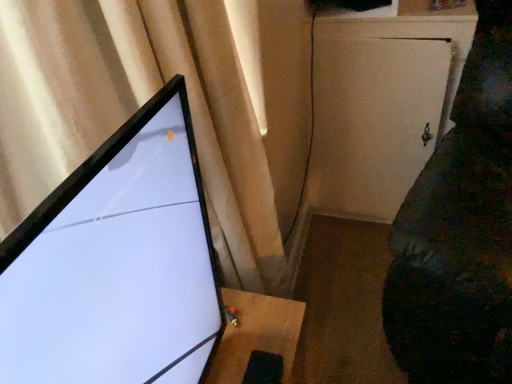
Question: From the image's perspective, is matte black monitor at left over matte beige curtain at upper left?

Choices:
 (A) no
 (B) yes

Answer: (A)

Question: Considering the relative sizes of matte black monitor at left and matte beige curtain at upper left in the image provided, is matte black monitor at left bigger than matte beige curtain at upper left?

Choices:
 (A) yes
 (B) no

Answer: (B)

Question: Is matte black monitor at left placed right next to matte beige curtain at upper left?

Choices:
 (A) no
 (B) yes

Answer: (A)

Question: Is matte black monitor at left to the left of matte beige curtain at upper left from the viewer's perspective?

Choices:
 (A) yes
 (B) no

Answer: (B)

Question: From the image's perspective, is matte black monitor at left under matte beige curtain at upper left?

Choices:
 (A) yes
 (B) no

Answer: (A)

Question: Considering the relative sizes of matte black monitor at left and matte beige curtain at upper left in the image provided, is matte black monitor at left taller than matte beige curtain at upper left?

Choices:
 (A) yes
 (B) no

Answer: (B)

Question: From the image's perspective, is white matte cabinet at right on velvet dark green couch at right?

Choices:
 (A) yes
 (B) no

Answer: (A)

Question: Is white matte cabinet at right facing away from velvet dark green couch at right?

Choices:
 (A) no
 (B) yes

Answer: (A)

Question: Can you confirm if white matte cabinet at right is positioned to the right of velvet dark green couch at right?

Choices:
 (A) no
 (B) yes

Answer: (A)

Question: Is white matte cabinet at right located outside velvet dark green couch at right?

Choices:
 (A) yes
 (B) no

Answer: (A)

Question: Is velvet dark green couch at right a part of white matte cabinet at right?

Choices:
 (A) no
 (B) yes

Answer: (A)

Question: Does white matte cabinet at right have a greater width compared to velvet dark green couch at right?

Choices:
 (A) yes
 (B) no

Answer: (B)

Question: Is velvet dark green couch at right thinner than matte black monitor at left?

Choices:
 (A) no
 (B) yes

Answer: (A)